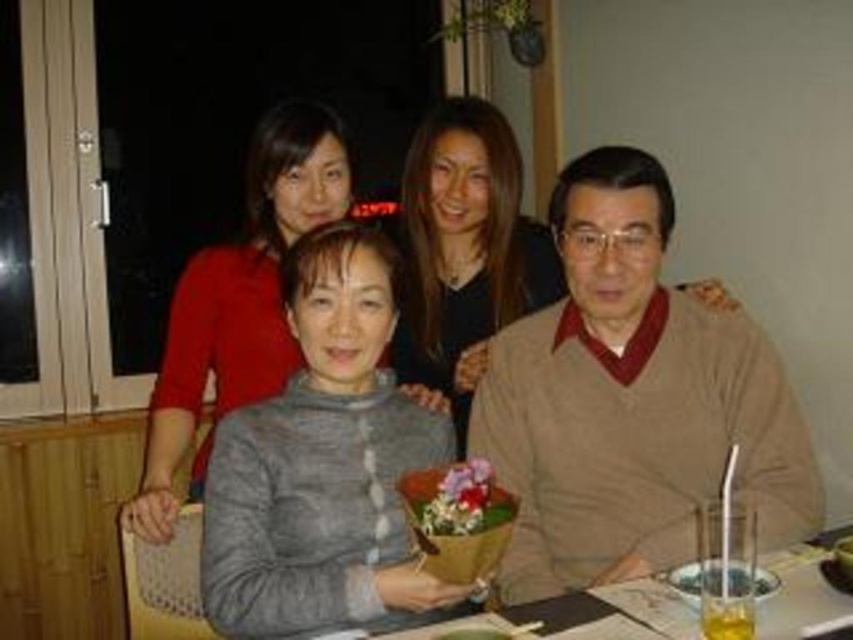
You are a photographer positioned at the back of the room and want to take a photo of the gray knitted sweater at center and the translucent glass bowl at lower right. Which object will appear larger in the photo?

The gray knitted sweater at center will appear larger in the photo because it is closer to the photographer than the translucent glass bowl at lower right.

Consider the image. You are an interior designer analyzing the spatial layout of the dining area. The gray knitted sweater at center is positioned at coordinates 0.467, 0.283. Based on this, where would you estimate the center of the dining table to be located?

The gray knitted sweater at center is positioned at coordinates (241, 298), so the center of the dining table is likely near those coordinates as well.